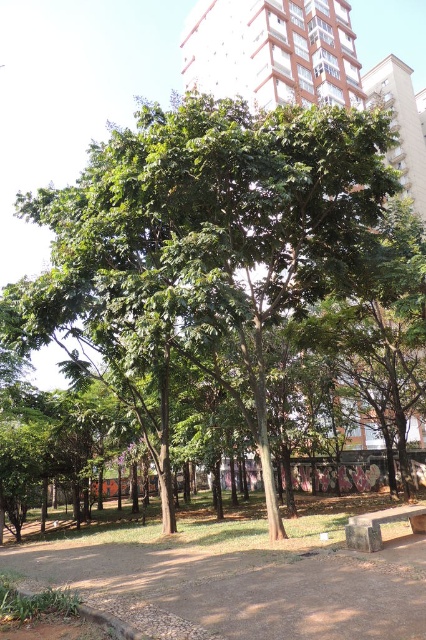
Question: From the image, what is the correct spatial relationship of green leafy tree at center in relation to stone bench at lower right?

Choices:
 (A) left
 (B) right

Answer: (A)

Question: In this image, where is green leafy tree at center located relative to stone bench at lower right?

Choices:
 (A) right
 (B) left

Answer: (B)

Question: Is the position of green leafy tree at center more distant than that of stone bench at lower right?

Choices:
 (A) yes
 (B) no

Answer: (A)

Question: Among these points, which one is farthest from the camera?

Choices:
 (A) (356, 534)
 (B) (382, 112)

Answer: (B)